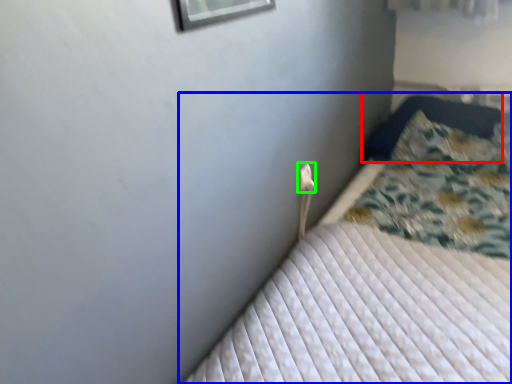
Question: Which object is the farthest from pillow (highlighted by a red box)? Choose among these: bed (highlighted by a blue box) or electric outlet (highlighted by a green box).

Choices:
 (A) bed
 (B) electric outlet

Answer: (B)